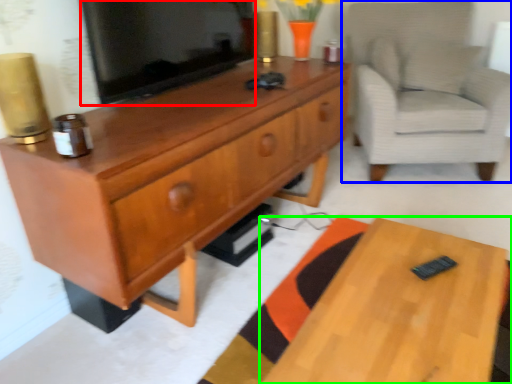
Question: Which object is positioned farthest from television (highlighted by a red box)? Select from chair (highlighted by a blue box) and desk (highlighted by a green box).

Choices:
 (A) chair
 (B) desk

Answer: (A)